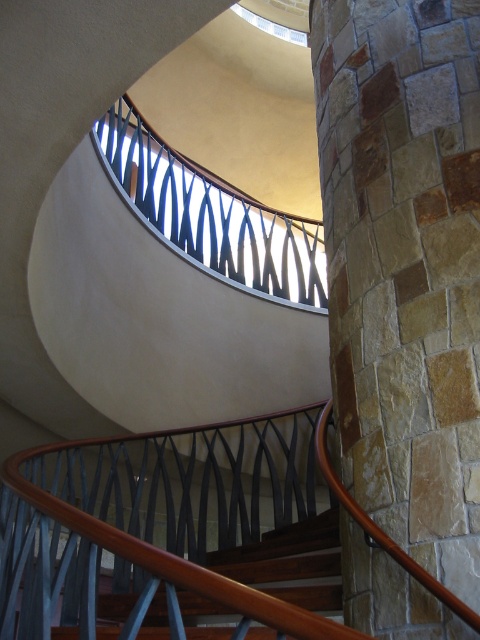
You are standing at the bottom of the spiral staircase and want to reach the upper level. You notice a natural stone pillar at right and a metallic black railing at upper center. Which object is taller?

The natural stone pillar at right is taller than the metallic black railing at upper center.

You are standing at the bottom of the spiral staircase looking upwards. There are two points marked on the wall. The first point is at coordinates point (362, 593) and the second point is at point (191, 218). Which point appears closer to you?

Point (362, 593) is closer to the camera than point (191, 218), so the first point appears closer to you.

You are a painter standing at the base of the spiral staircase. You want to paint both the natural stone pillar at right and the metallic black railing at upper center. If your ladder can reach up to 3 meters, will you be able to reach both objects without moving the ladder?

The natural stone pillar at right and metallic black railing at upper center are 3.29 meters apart. Since the ladder can only reach up to 3 meters, you will not be able to reach both objects without moving the ladder because the distance between them exceeds the ladder height limit.